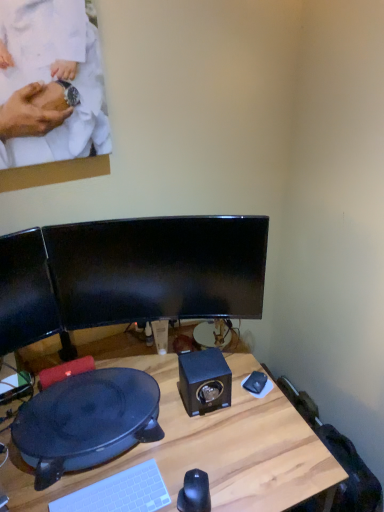
You are a GUI agent. You are given a task and a screenshot of the screen. Output one action in this format:
    pyautogui.click(x=<x>, y=<y>)
    Task: Click on the free space that is in between black matte speaker at center and white plastic keyboard at lower center
    Image resolution: width=384 pixels, height=512 pixels.
    Given the screenshot: What is the action you would take?
    pyautogui.click(x=163, y=446)